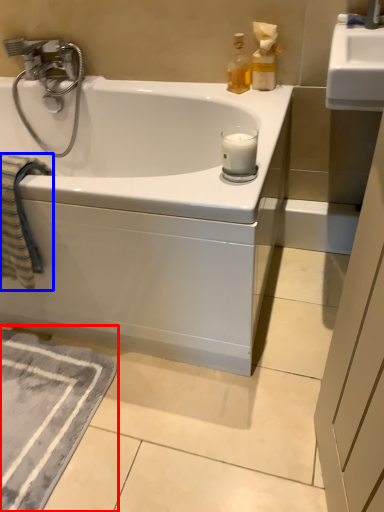
Question: Which object appears farthest to the camera in this image, bath mat (highlighted by a red box) or beach towel (highlighted by a blue box)?

Choices:
 (A) bath mat
 (B) beach towel

Answer: (A)